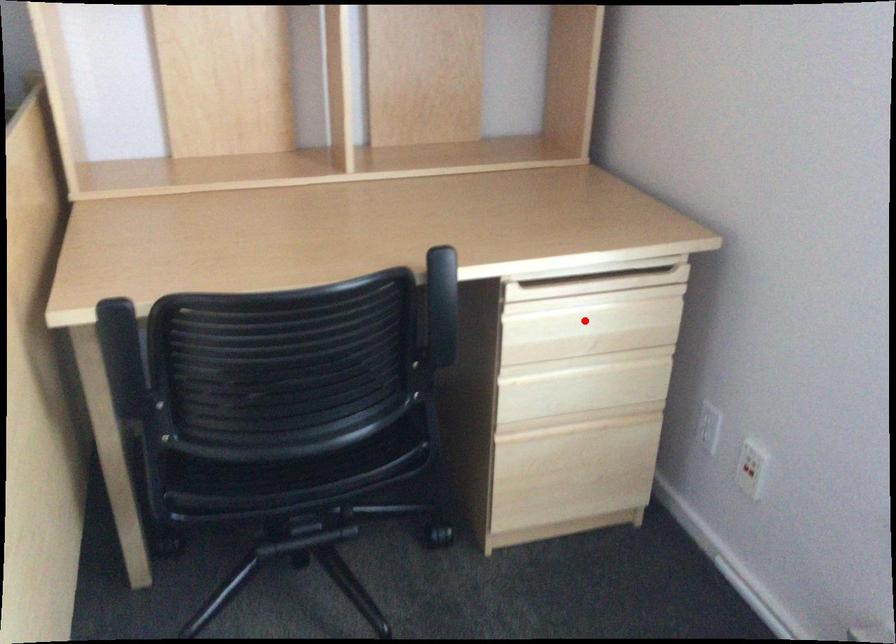
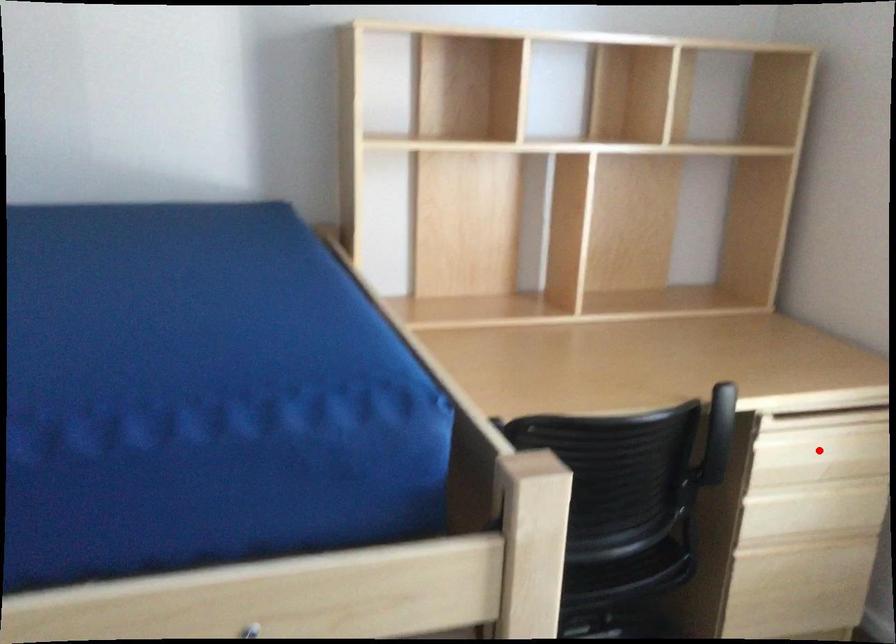
I am providing you with two images of the same scene from different viewpoints. A red point is marked on the first image and another point is marked on the second image. Are the points marked in image1 and image2 representing the same 3D position?

Yes